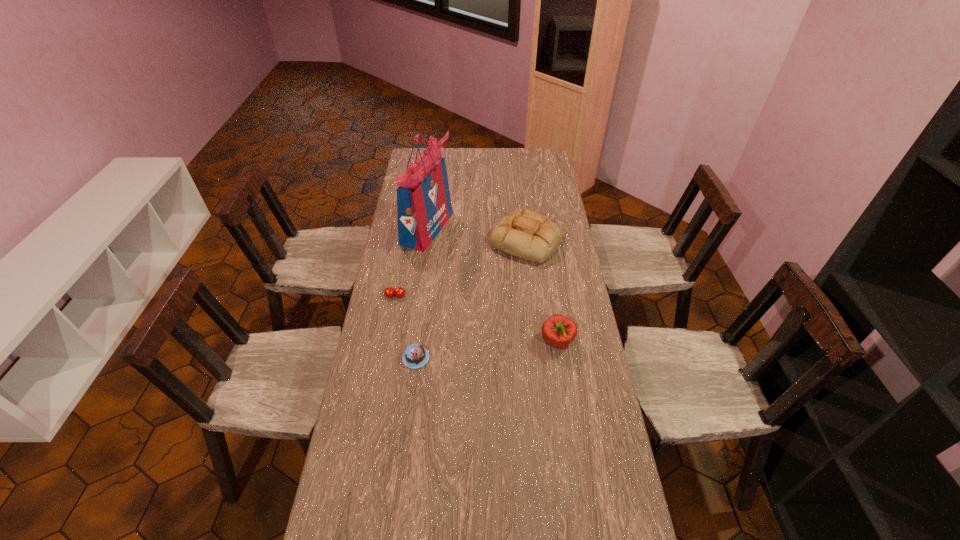
Locate an element on the screen. This screenshot has height=540, width=960. the tallest object is located at coordinates (424, 206).

Where is `bread`? This screenshot has width=960, height=540. bread is located at coordinates (526, 234).

Identify the location of bell pepper. This screenshot has height=540, width=960. (559, 331).

The width and height of the screenshot is (960, 540). I want to click on the third farthest object, so click(389, 292).

Locate an element on the screen. the shortest object is located at coordinates (415, 356).

The height and width of the screenshot is (540, 960). In order to click on free space located 0.330m on the front-facing side of the tallest object in this screenshot , I will do `click(526, 228)`.

Where is `vacant space located 0.060m on the front of the bread`? The image size is (960, 540). vacant space located 0.060m on the front of the bread is located at coordinates (530, 276).

You are a GUI agent. You are given a task and a screenshot of the screen. Output one action in this format:
    pyautogui.click(x=<x>, y=<y>)
    Task: Click on the vacant space located 0.310m on the left of the bell pepper
    
    Given the screenshot: What is the action you would take?
    pyautogui.click(x=451, y=342)

Where is `free space located 0.210m with the stems of the cherry pointing upwards`? free space located 0.210m with the stems of the cherry pointing upwards is located at coordinates (386, 345).

At what (x,y) coordinates should I click in order to perform the action: click on vacant space located on the front of the chocolate cake. Please return your answer as a coordinate pair (x, y). The image size is (960, 540). Looking at the image, I should click on (399, 490).